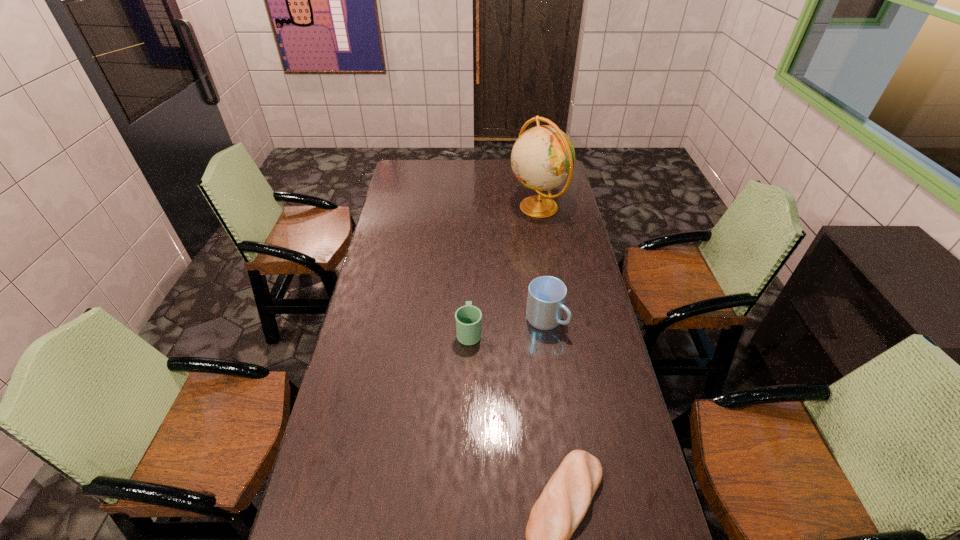
This screenshot has height=540, width=960. In order to click on the farthest object in this screenshot , I will do `click(543, 157)`.

Locate an element on the screen. the tallest object is located at coordinates (543, 157).

Identify the location of the right mug. (546, 298).

The image size is (960, 540). I want to click on the second tallest object, so click(x=546, y=298).

You are a GUI agent. You are given a task and a screenshot of the screen. Output one action in this format:
    pyautogui.click(x=<x>, y=<y>)
    Task: Click on the shorter mug
    Image resolution: width=960 pixels, height=540 pixels.
    Given the screenshot: What is the action you would take?
    pyautogui.click(x=468, y=318)

Where is `the third tallest object`? the third tallest object is located at coordinates (468, 318).

Locate an element on the screen. The height and width of the screenshot is (540, 960). free space located on the left of the globe is located at coordinates (488, 207).

Locate an element on the screen. Image resolution: width=960 pixels, height=540 pixels. blank area located 0.390m on the back of the right mug is located at coordinates (534, 240).

The image size is (960, 540). I want to click on free space located 0.230m on the side of the leftmost object with the handle, so click(x=470, y=274).

Find the location of `vacant space located 0.110m on the side of the leftmost object with the handle`. vacant space located 0.110m on the side of the leftmost object with the handle is located at coordinates (470, 295).